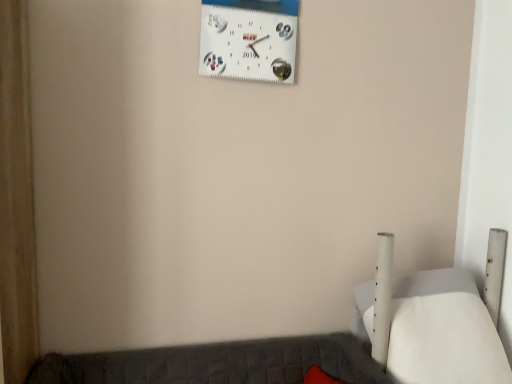
Question: From a real-world perspective, is white matte bed at lower right positioned above or below white matte wall clock at upper center?

Choices:
 (A) below
 (B) above

Answer: (A)

Question: Would you say white matte bed at lower right is to the left or to the right of white matte wall clock at upper center in the picture?

Choices:
 (A) left
 (B) right

Answer: (B)

Question: In terms of width, does white matte bed at lower right look wider or thinner when compared to white matte wall clock at upper center?

Choices:
 (A) thin
 (B) wide

Answer: (B)

Question: From a real-world perspective, is white matte wall clock at upper center physically located above or below white matte bed at lower right?

Choices:
 (A) below
 (B) above

Answer: (B)

Question: From the image's perspective, is white matte wall clock at upper center positioned above or below white matte bed at lower right?

Choices:
 (A) below
 (B) above

Answer: (B)

Question: Would you say white matte wall clock at upper center is to the left or to the right of white matte bed at lower right in the picture?

Choices:
 (A) left
 (B) right

Answer: (A)

Question: Is point (258, 69) closer or farther from the camera than point (454, 274)?

Choices:
 (A) closer
 (B) farther

Answer: (A)